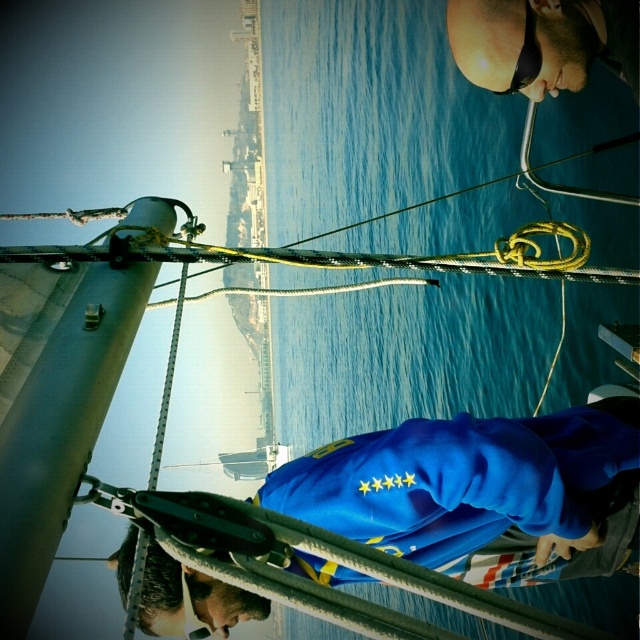
Looking at this image, you are a photographer on the sailboat deck and want to capture both the point at coordinates point (397, 481) and point (472, 35) in your shot. Based on their positions, which point will appear larger in the photo?

Point (397, 481) is closer to the camera than point (472, 35), so it will appear larger in the photo.

Consider the image. You are a sailor on the deck of the boat and need to retrieve an item. You see the blue fabric at center and the sunglasses at upper center. Which one is closer to the left side of the deck?

The blue fabric at center is closer to the left side of the deck because it is positioned to the left of the sunglasses at upper center.

You are a sailor on the deck of a sailboat. You notice a blue fabric at center and sunglasses at upper center. Which object is located closer to the horizon?

The sunglasses at upper center are closer to the horizon because the blue fabric at center is positioned under it, meaning the sunglasses are higher up in the frame.